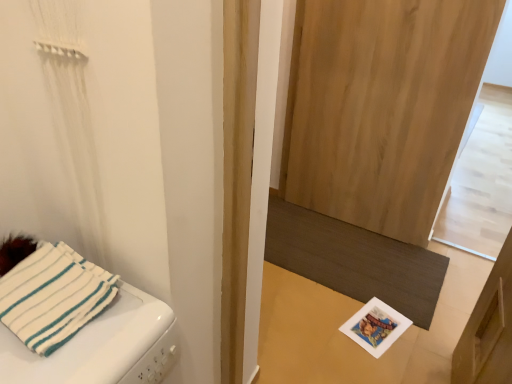
You are a GUI agent. You are given a task and a screenshot of the screen. Output one action in this format:
    pyautogui.click(x=<x>, y=<y>)
    Task: Click on the empty space that is ontop of dark brown textured mat at lower center (from a real-world perspective)
    The width and height of the screenshot is (512, 384).
    Given the screenshot: What is the action you would take?
    pyautogui.click(x=337, y=248)